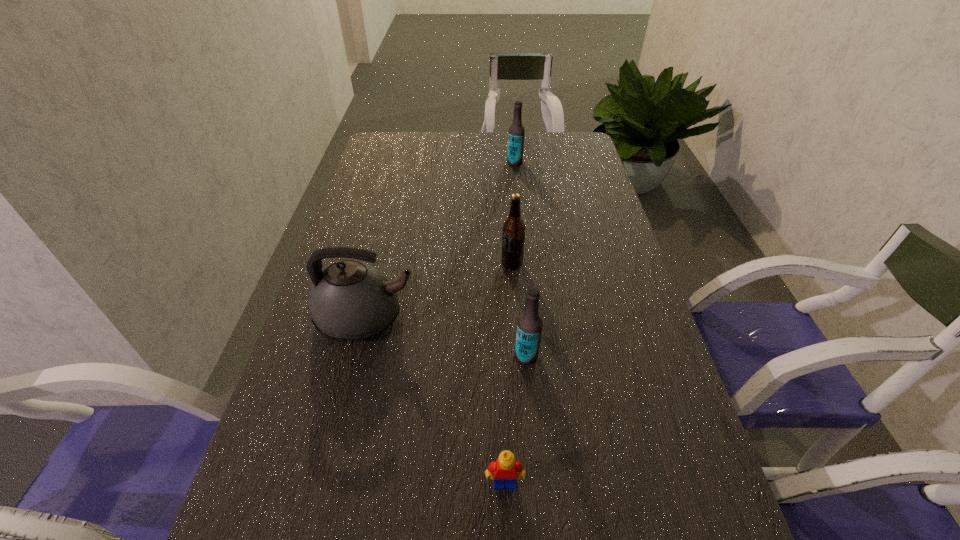
Image resolution: width=960 pixels, height=540 pixels. I want to click on the farthest beer bottle, so click(x=516, y=134).

Where is `the second nearest beer bottle`? The image size is (960, 540). the second nearest beer bottle is located at coordinates (513, 232).

Identify the location of kettle. Image resolution: width=960 pixels, height=540 pixels. (349, 300).

Locate an element on the screen. The height and width of the screenshot is (540, 960). the nearest beer bottle is located at coordinates (529, 326).

The height and width of the screenshot is (540, 960). In order to click on the nearest object in this screenshot , I will do `click(505, 468)`.

Where is `the shortest object`? the shortest object is located at coordinates (505, 468).

Locate an element on the screen. This screenshot has height=540, width=960. free space located on the side of the farthest object with the label is located at coordinates (429, 163).

Where is `free space located 0.340m on the side of the farthest object with the label`? free space located 0.340m on the side of the farthest object with the label is located at coordinates (413, 163).

At what (x,y) coordinates should I click in order to perform the action: click on free space located 0.210m on the side of the farthest object with the label. Please return your answer as a coordinate pair (x, y). Looking at the image, I should click on (448, 163).

Find the location of a particular element. free location located on the label of the fourth nearest object is located at coordinates point(420,264).